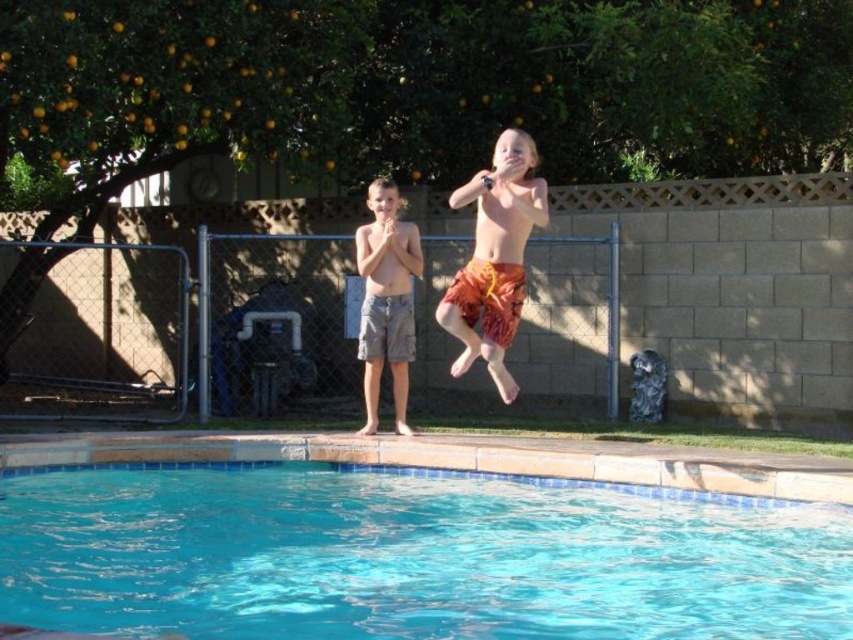
You are a photographer trying to capture the moment when both the orange printed shorts at center and the camo shorts at center are visible in the frame. Based on their positions, which one should you focus on first to ensure both are in the shot?

The orange printed shorts at center is located above camo shorts at center, so you should focus on the orange printed shorts at center first to ensure both are in the shot.

Based on the photo, you are designing a safety barrier for the backyard pool. The blue tile water at center and orange printed shorts at center are in the image. Which object is wider so that the barrier can be placed accordingly?

The blue tile water at center is wider than orange printed shorts at center, so the barrier should be placed considering the width of the blue tile water at center.